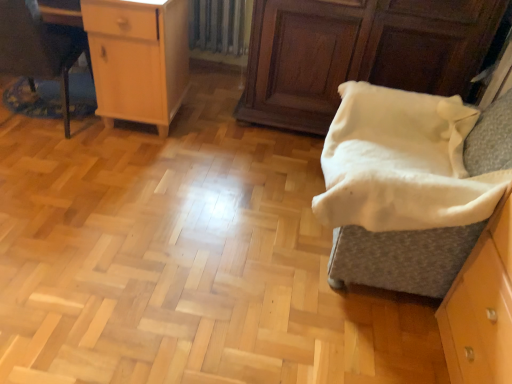
Question: Could you tell me if brushed metal desk at left is facing light wood cabinet at upper left?

Choices:
 (A) no
 (B) yes

Answer: (B)

Question: Is light wood cabinet at upper left surrounded by brushed metal desk at left?

Choices:
 (A) yes
 (B) no

Answer: (B)

Question: Is there a large distance between brushed metal desk at left and light wood cabinet at upper left?

Choices:
 (A) yes
 (B) no

Answer: (B)

Question: Considering the relative sizes of brushed metal desk at left and light wood cabinet at upper left in the image provided, is brushed metal desk at left bigger than light wood cabinet at upper left?

Choices:
 (A) yes
 (B) no

Answer: (B)

Question: Can you confirm if brushed metal desk at left is taller than light wood cabinet at upper left?

Choices:
 (A) yes
 (B) no

Answer: (A)

Question: Does brushed metal desk at left come behind light wood cabinet at upper left?

Choices:
 (A) no
 (B) yes

Answer: (A)

Question: From a real-world perspective, is light wood cabinet at upper left physically below brushed metal desk at left?

Choices:
 (A) yes
 (B) no

Answer: (B)

Question: Is light wood cabinet at upper left oriented away from brushed metal desk at left?

Choices:
 (A) yes
 (B) no

Answer: (A)

Question: Is light wood cabinet at upper left to the left of brushed metal desk at left from the viewer's perspective?

Choices:
 (A) yes
 (B) no

Answer: (B)

Question: From the image's perspective, is light wood cabinet at upper left located beneath brushed metal desk at left?

Choices:
 (A) no
 (B) yes

Answer: (A)

Question: Is light wood cabinet at upper left bigger than brushed metal desk at left?

Choices:
 (A) no
 (B) yes

Answer: (B)

Question: Considering the relative positions of light wood cabinet at upper left and brushed metal desk at left in the image provided, is light wood cabinet at upper left to the right of brushed metal desk at left from the viewer's perspective?

Choices:
 (A) no
 (B) yes

Answer: (B)

Question: Considering the relative sizes of light wood cabinet at upper left and white soft blanket at right in the image provided, is light wood cabinet at upper left wider than white soft blanket at right?

Choices:
 (A) no
 (B) yes

Answer: (A)